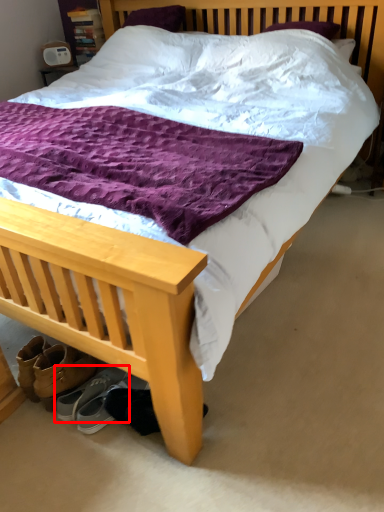
Question: From the image's perspective, where is footwear (annotated by the red box) located in relation to footwear in the image?

Choices:
 (A) below
 (B) above

Answer: (B)